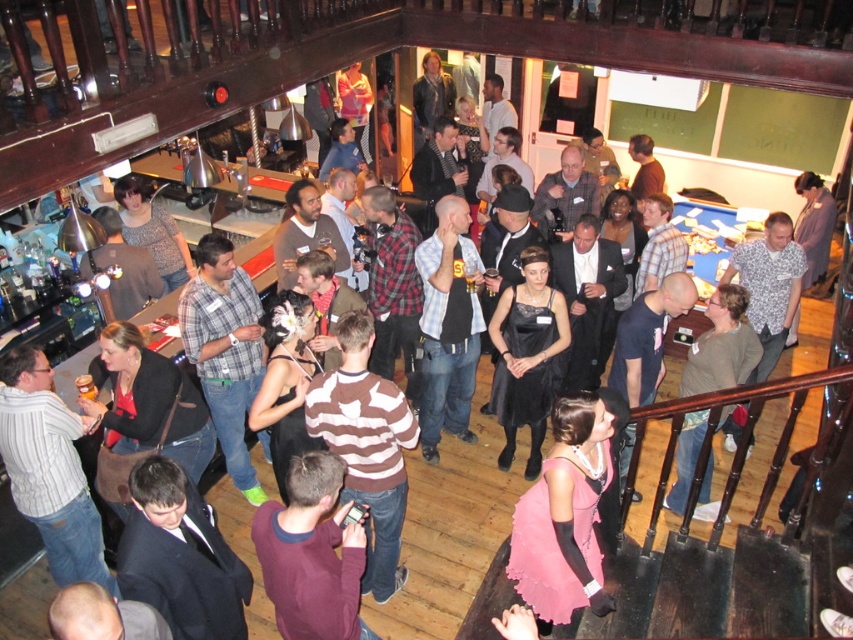
You are standing at the entrance of the bar and want to locate the pink satin dress at center. Based on the coordinates provided, in which direction should you look to find it?

The pink satin dress at center is located at coordinates point (566, 513), which is towards the upper right direction from your current position at the entrance.